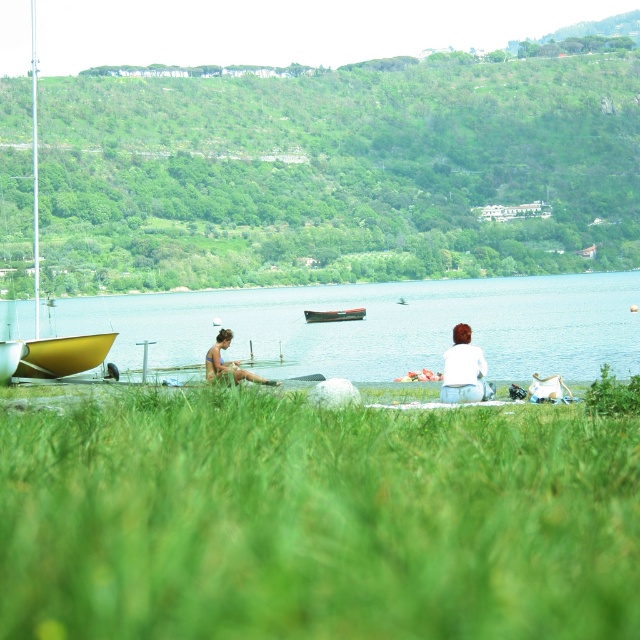
You are standing at the edge of the lake and want to take a photo of the green grassy field at lower center and the blue water at center. Which object will appear larger in your photo?

The green grassy field at lower center will appear larger in the photo because it is closer to the viewer compared to the blue water at center.

You are standing at the center of the image and want to walk towards the green grassy field at lower center. Which direction should you move?

The green grassy field at lower center is located at point coordinates of 0.812 on the x axis and 0.494 on the y axis. Since the point is lower center, you should move downward from the center to reach it.

You are standing at the edge of the lake and want to take a photo of the green grassy field at lower center and the matte blue swimsuit at center. Which object should you focus on if you want the swimsuit to be in sharp focus while keeping the grass slightly out of focus?

To ensure the matte blue swimsuit at center is in sharp focus while keeping the green grassy field at lower center slightly out of focus, you should focus on the swimsuit. Since the green grassy field at lower center is located above the swimsuit, adjusting the focus to the closer object would keep the background elements like the grass blurred.